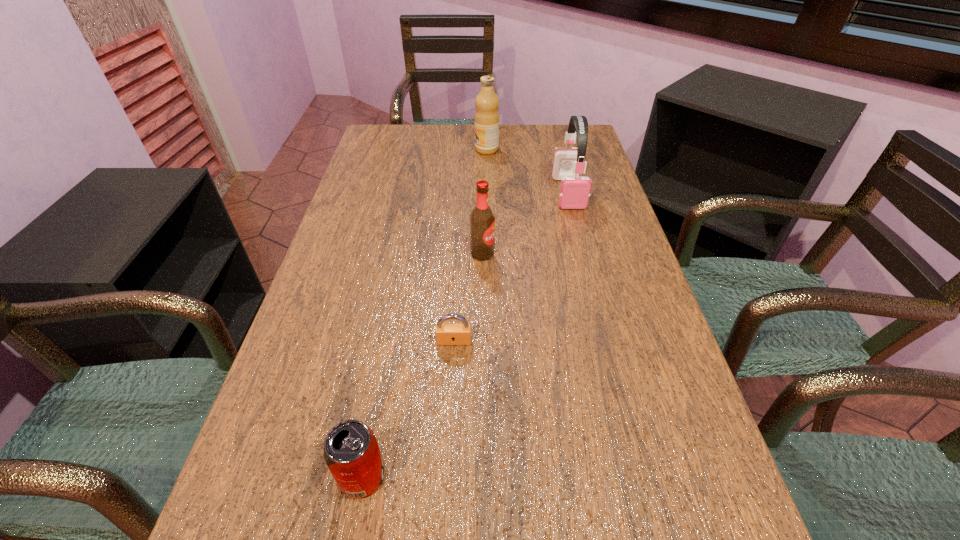
Locate an element on the screen. free space located on the label of the farthest object is located at coordinates (420, 150).

Where is `free location located on the outer surface of the fourth nearest object`? free location located on the outer surface of the fourth nearest object is located at coordinates (582, 246).

The height and width of the screenshot is (540, 960). In order to click on vacant space situated 0.130m on the front of the beer bottle in this screenshot , I will do `click(483, 301)`.

Find the location of a particular element. The image size is (960, 540). vacant space located on the back of the nearest object is located at coordinates (385, 358).

Identify the location of vacant space located 0.090m to unlock the padlock from the front. (451, 385).

Where is `object that is at the far edge`? This screenshot has width=960, height=540. object that is at the far edge is located at coordinates (486, 102).

You are a GUI agent. You are given a task and a screenshot of the screen. Output one action in this format:
    pyautogui.click(x=<x>, y=<y>)
    Task: Click on the object located at the left edge
    The height and width of the screenshot is (540, 960).
    Given the screenshot: What is the action you would take?
    pyautogui.click(x=351, y=451)

Find the location of a particular element. This screenshot has height=540, width=960. object present at the right edge is located at coordinates coord(574,193).

This screenshot has width=960, height=540. In the image, there is a desktop. In order to click on vacant space at the far edge in this screenshot , I will do `click(451, 133)`.

In the image, there is a desktop. In order to click on vacant space at the left edge in this screenshot , I will do `click(365, 167)`.